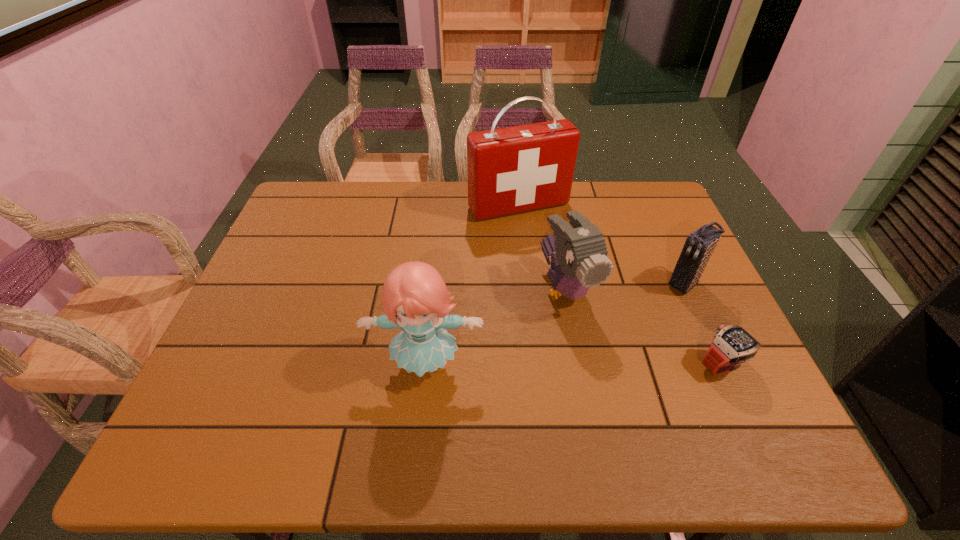
I want to click on free space between the bird and the clutch bag, so click(x=626, y=287).

This screenshot has width=960, height=540. What are the coordinates of `free space between the watch and the tallest object` in the screenshot? It's located at (620, 285).

This screenshot has height=540, width=960. Find the location of `free point between the clutch bag and the second tallest object`. free point between the clutch bag and the second tallest object is located at coordinates (556, 325).

Image resolution: width=960 pixels, height=540 pixels. Identify the location of free spot between the clutch bag and the shortest object. (704, 325).

Find the location of `vacant space in between the first-aid kit and the shortest object`. vacant space in between the first-aid kit and the shortest object is located at coordinates point(620,285).

Identify the location of free area in between the clutch bag and the shortest object. The image size is (960, 540). (704, 325).

Find the location of a particular element. This screenshot has width=960, height=540. free space that is in between the second tallest object and the clutch bag is located at coordinates (556, 325).

Choose which object is the second nearest neighbor to the bird. Please provide its 2D coordinates. Your answer should be formatted as a tuple, i.e. [(x, y)], where the tuple contains the x and y coordinates of a point satisfying the conditions above.

[(510, 170)]

Locate an element on the screen. The width and height of the screenshot is (960, 540). object identified as the fourth closest to the clutch bag is located at coordinates (415, 291).

The height and width of the screenshot is (540, 960). What are the coordinates of `free point that satisfies the following two spatial constraints: 1. on the front side of the first-aid kit; 2. on the left side of the bird` in the screenshot? It's located at (527, 289).